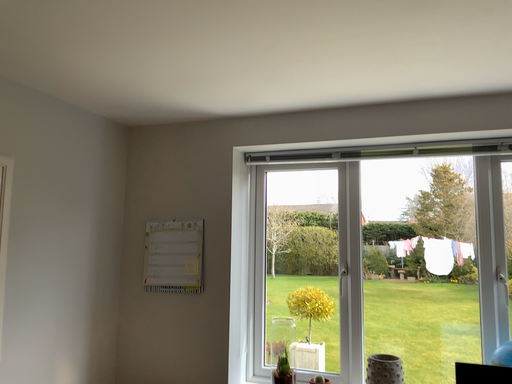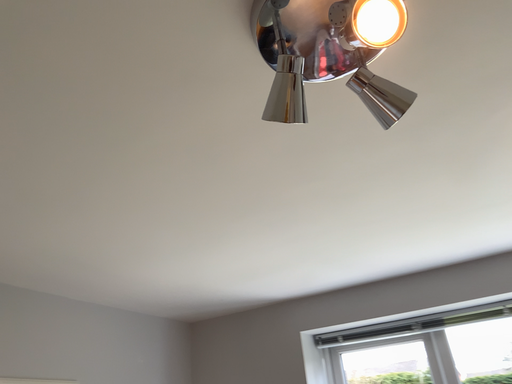
Question: Which way did the camera rotate in the video?

Choices:
 (A) rotated right
 (B) rotated left

Answer: (B)